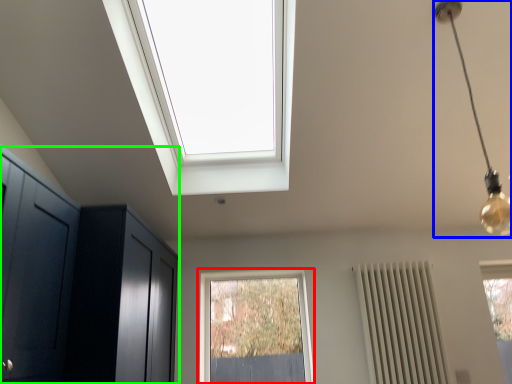
Question: Which object is the farthest from window (highlighted by a red box)? Choose among these: light fixture (highlighted by a blue box) or dresser (highlighted by a green box).

Choices:
 (A) light fixture
 (B) dresser

Answer: (A)